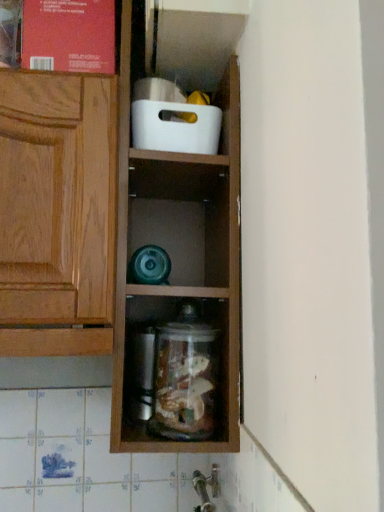
Locate an element on the screen. The height and width of the screenshot is (512, 384). silver metallic faucet at lower center is located at coordinates (206, 488).

Where is `clear glass jar at center`? clear glass jar at center is located at coordinates (184, 382).

From the picture: What is the approximate width of clear glass jar at center?

The width of clear glass jar at center is 5.44 inches.

The image size is (384, 512). What are the coordinates of `white plastic container at upper center` in the screenshot? It's located at (193, 124).

Is white plastic container at upper center far away from matte red book at upper left?

They are positioned close to each other.

In the scene shown: Is white plastic container at upper center facing away from matte red book at upper left?

No, white plastic container at upper center's orientation is not away from matte red book at upper left.

Considering the positions of objects white plastic container at upper center and matte red book at upper left in the image provided, who is more to the right, white plastic container at upper center or matte red book at upper left?

white plastic container at upper center is more to the right.

Considering the points (223, 90) and (25, 33), which point is behind, point (223, 90) or point (25, 33)?

Positioned behind is point (223, 90).

Considering the positions of objects clear glass jar at center and matte red book at upper left in the image provided, who is in front, clear glass jar at center or matte red book at upper left?

clear glass jar at center is closer to the camera.

From the picture: Can you tell me how much clear glass jar at center and matte red book at upper left differ in facing direction?

4.39 degrees.

Which is closer, (203, 351) or (108, 16)?

Point (203, 351) is farther from the camera than point (108, 16).

In terms of size, does clear glass jar at center appear bigger or smaller than matte red book at upper left?

In the image, clear glass jar at center appears to be smaller than matte red book at upper left.

Between matte red book at upper left and silver metallic faucet at lower center, which one has larger width?

matte red book at upper left.

How different are the orientations of matte red book at upper left and silver metallic faucet at lower center in degrees?

The angular difference between matte red book at upper left and silver metallic faucet at lower center is 89.2 degrees.

Which object is more forward, matte red book at upper left or silver metallic faucet at lower center?

silver metallic faucet at lower center is closer to the camera.

Considering the relative positions of matte red book at upper left and silver metallic faucet at lower center in the image provided, is matte red book at upper left to the right of silver metallic faucet at lower center from the viewer's perspective?

In fact, matte red book at upper left is to the left of silver metallic faucet at lower center.

How distant is silver metallic faucet at lower center from clear glass jar at center?

They are 11.51 inches apart.

Which is more to the left, silver metallic faucet at lower center or clear glass jar at center?

Positioned to the left is clear glass jar at center.

In the scene shown: Is silver metallic faucet at lower center facing towards clear glass jar at center?

No, silver metallic faucet at lower center is not facing towards clear glass jar at center.

Is silver metallic faucet at lower center taller than clear glass jar at center?

In fact, silver metallic faucet at lower center may be shorter than clear glass jar at center.

Can you confirm if white plastic container at upper center is thinner than silver metallic faucet at lower center?

Incorrect, the width of white plastic container at upper center is not less than that of silver metallic faucet at lower center.

From the image's perspective, is white plastic container at upper center above or below silver metallic faucet at lower center?

white plastic container at upper center is above silver metallic faucet at lower center.

Would you say white plastic container at upper center is to the left or to the right of silver metallic faucet at lower center in the picture?

Based on their positions, white plastic container at upper center is located to the left of silver metallic faucet at lower center.

Looking at this image, from a real-world perspective, does white plastic container at upper center sit lower than silver metallic faucet at lower center?

Actually, white plastic container at upper center is physically above silver metallic faucet at lower center in the real world.

Which of these two, clear glass jar at center or silver metallic faucet at lower center, stands shorter?

silver metallic faucet at lower center.

Is clear glass jar at center further to camera compared to silver metallic faucet at lower center?

No, the depth of clear glass jar at center is less than that of silver metallic faucet at lower center.

Is clear glass jar at center turned away from silver metallic faucet at lower center?

No, clear glass jar at center is not facing away from silver metallic faucet at lower center.

Can you confirm if clear glass jar at center is wider than silver metallic faucet at lower center?

Indeed, clear glass jar at center has a greater width compared to silver metallic faucet at lower center.

Would you say silver metallic faucet at lower center is a long distance from matte red book at upper left?

No, silver metallic faucet at lower center is in close proximity to matte red book at upper left.

Considering the points (206, 511) and (105, 58), which point is behind, point (206, 511) or point (105, 58)?

Point (206, 511)

From a real-world perspective, is silver metallic faucet at lower center over matte red book at upper left?

No, from a real-world perspective, silver metallic faucet at lower center is not over matte red book at upper left

Which object is thinner, silver metallic faucet at lower center or matte red book at upper left?

Thinner between the two is silver metallic faucet at lower center.

Locate an element on the screen. The image size is (384, 512). cabinet that is under the matte red book at upper left (from a real-world perspective) is located at coordinates (193, 124).

Where is `book to the left of clear glass jar at center`? This screenshot has width=384, height=512. book to the left of clear glass jar at center is located at coordinates (68, 35).

Considering their positions, is matte red book at upper left positioned further to clear glass jar at center than silver metallic faucet at lower center?

matte red book at upper left is positioned further to the anchor clear glass jar at center.

Estimate the real-world distances between objects in this image. Which object is further from white plastic container at upper center, silver metallic faucet at lower center or matte red book at upper left?

silver metallic faucet at lower center is further to white plastic container at upper center.

Estimate the real-world distances between objects in this image. Which object is further from clear glass jar at center, silver metallic faucet at lower center or white plastic container at upper center?

white plastic container at upper center.

Which object lies further to the anchor point silver metallic faucet at lower center, matte red book at upper left or white plastic container at upper center?

matte red book at upper left is positioned further to the anchor silver metallic faucet at lower center.

From the image, which object appears to be farther from silver metallic faucet at lower center, clear glass jar at center or matte red book at upper left?

The object further to silver metallic faucet at lower center is matte red book at upper left.

Based on their spatial positions, is white plastic container at upper center or matte red book at upper left closer to silver metallic faucet at lower center?

white plastic container at upper center lies closer to silver metallic faucet at lower center than the other object.

Which object lies further to the anchor point silver metallic faucet at lower center, matte red book at upper left or clear glass jar at center?

Based on the image, matte red book at upper left appears to be further to silver metallic faucet at lower center.

Considering their positions, is clear glass jar at center positioned further to matte red book at upper left than silver metallic faucet at lower center?

silver metallic faucet at lower center lies further to matte red book at upper left than the other object.

The image size is (384, 512). What are the coordinates of `glass jar that lies between matte red book at upper left and silver metallic faucet at lower center from top to bottom` in the screenshot? It's located at point(184,382).

Where is `cabinet that lies between matte red book at upper left and silver metallic faucet at lower center from top to bottom`? cabinet that lies between matte red book at upper left and silver metallic faucet at lower center from top to bottom is located at coordinates (193, 124).

I want to click on cabinet between matte red book at upper left and clear glass jar at center from top to bottom, so click(193, 124).

Find the location of `glass jar between white plastic container at upper center and silver metallic faucet at lower center from top to bottom`. glass jar between white plastic container at upper center and silver metallic faucet at lower center from top to bottom is located at coordinates (184, 382).